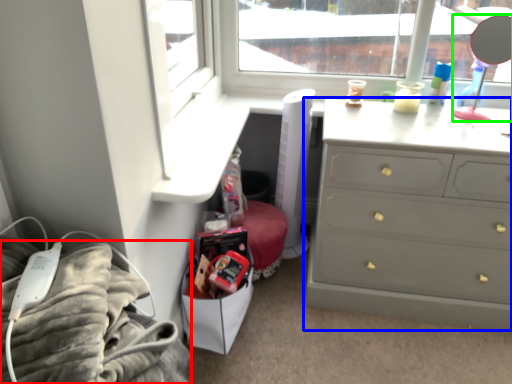
Question: Which is farther away from bedding (highlighted by a red box)? chest of drawers (highlighted by a blue box) or mirror (highlighted by a green box)?

Choices:
 (A) chest of drawers
 (B) mirror

Answer: (B)